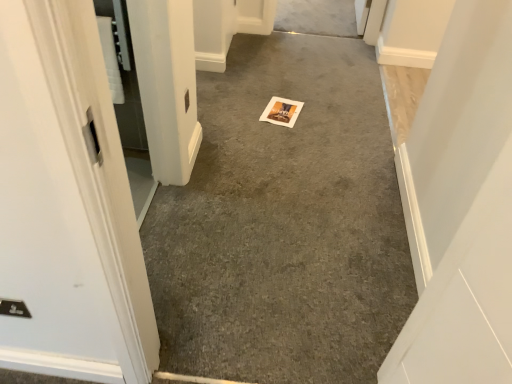
What do you see at coordinates (284, 223) in the screenshot? I see `gray carpet at center` at bounding box center [284, 223].

Measure the distance between gray carpet at center and camera.

1.41 meters.

Identify the location of gray carpet at center. This screenshot has height=384, width=512. (284, 223).

At what (x,y) coordinates should I click in order to perform the action: click on gray carpet at center. Please return your answer as a coordinate pair (x, y). Looking at the image, I should click on (284, 223).